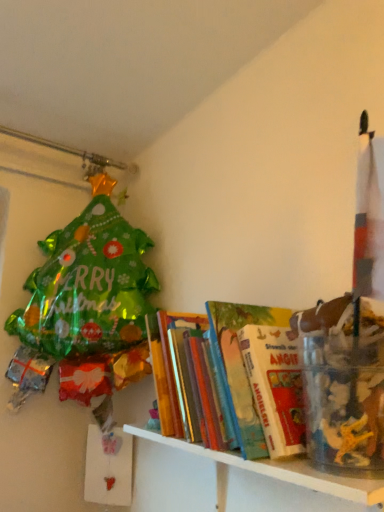
Question: Can you confirm if white wooden shelf at lower right, the first shelf from the bottom, is thinner than hardcover books at center, the 1th shelf positioned from the top?

Choices:
 (A) yes
 (B) no

Answer: (A)

Question: Is white wooden shelf at lower right, the first shelf from the bottom, surrounding hardcover books at center, the 1th shelf positioned from the top?

Choices:
 (A) no
 (B) yes

Answer: (A)

Question: From the image's perspective, is white wooden shelf at lower right, marked as the second shelf in a top-to-bottom arrangement, located beneath hardcover books at center, the 1th shelf positioned from the top?

Choices:
 (A) yes
 (B) no

Answer: (A)

Question: Is white wooden shelf at lower right, the first shelf from the bottom, at the right side of hardcover books at center, the 2th shelf when ordered from bottom to top?

Choices:
 (A) no
 (B) yes

Answer: (B)

Question: Is white wooden shelf at lower right, marked as the second shelf in a top-to-bottom arrangement, touching hardcover books at center, the 1th shelf positioned from the top?

Choices:
 (A) yes
 (B) no

Answer: (A)

Question: Does white wooden shelf at lower right, marked as the second shelf in a top-to-bottom arrangement, lie in front of hardcover books at center, the 2th shelf when ordered from bottom to top?

Choices:
 (A) yes
 (B) no

Answer: (A)

Question: Does hardcover books at center, the 1th shelf positioned from the top, have a greater width compared to white wooden shelf at lower right, the first shelf from the bottom?

Choices:
 (A) no
 (B) yes

Answer: (B)

Question: Is hardcover books at center, the 2th shelf when ordered from bottom to top, positioned far away from white wooden shelf at lower right, the first shelf from the bottom?

Choices:
 (A) yes
 (B) no

Answer: (B)

Question: Could you tell me if hardcover books at center, the 1th shelf positioned from the top, is turned towards white wooden shelf at lower right, the first shelf from the bottom?

Choices:
 (A) yes
 (B) no

Answer: (B)

Question: Is hardcover books at center, the 2th shelf when ordered from bottom to top, looking in the opposite direction of white wooden shelf at lower right, the first shelf from the bottom?

Choices:
 (A) yes
 (B) no

Answer: (B)

Question: From a real-world perspective, is hardcover books at center, the 1th shelf positioned from the top, over white wooden shelf at lower right, the first shelf from the bottom?

Choices:
 (A) yes
 (B) no

Answer: (A)

Question: Is the depth of hardcover books at center, the 2th shelf when ordered from bottom to top, less than that of white wooden shelf at lower right, the first shelf from the bottom?

Choices:
 (A) no
 (B) yes

Answer: (A)

Question: From their relative heights in the image, would you say white wooden shelf at lower right, the first shelf from the bottom, is taller or shorter than hardcover books at center, the 2th shelf when ordered from bottom to top?

Choices:
 (A) short
 (B) tall

Answer: (A)